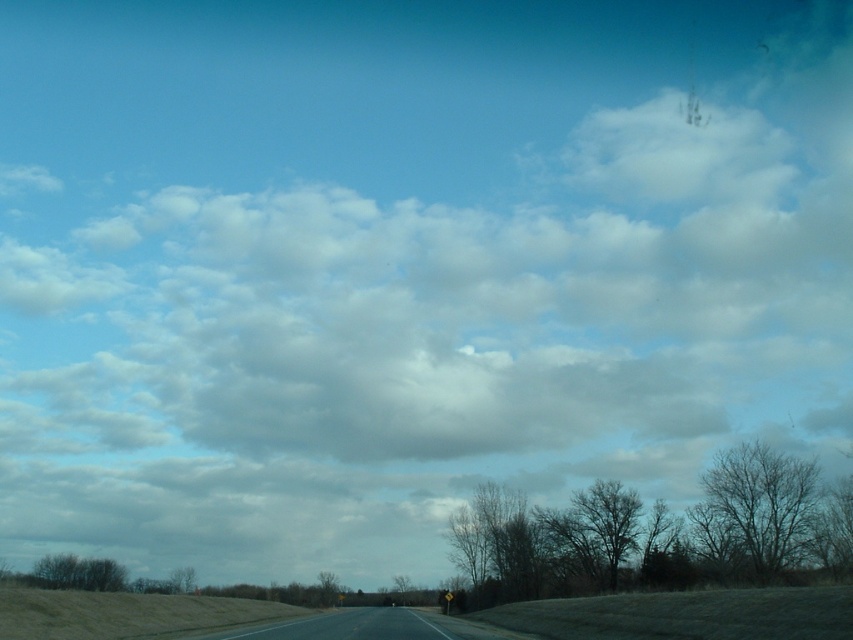
Question: Can you confirm if bare branches at center is wider than bare branches at right?

Choices:
 (A) no
 (B) yes

Answer: (B)

Question: Is bare branches at right wider than dark brown textured tree at center?

Choices:
 (A) no
 (B) yes

Answer: (A)

Question: Among these points, which one is farthest from the camera?

Choices:
 (A) (753, 525)
 (B) (302, 616)
 (C) (492, 568)
 (D) (509, 556)

Answer: (C)

Question: Can you confirm if bare branches at center is positioned above asphalt road at center?

Choices:
 (A) no
 (B) yes

Answer: (B)

Question: Which object is positioned farthest from the asphalt road at center?

Choices:
 (A) bare branches at right
 (B) bare branches at center
 (C) dark brown textured tree at center

Answer: (A)

Question: Which object is closer to the camera taking this photo?

Choices:
 (A) bare branches at center
 (B) dark brown textured tree at center
 (C) bare branches at right

Answer: (A)